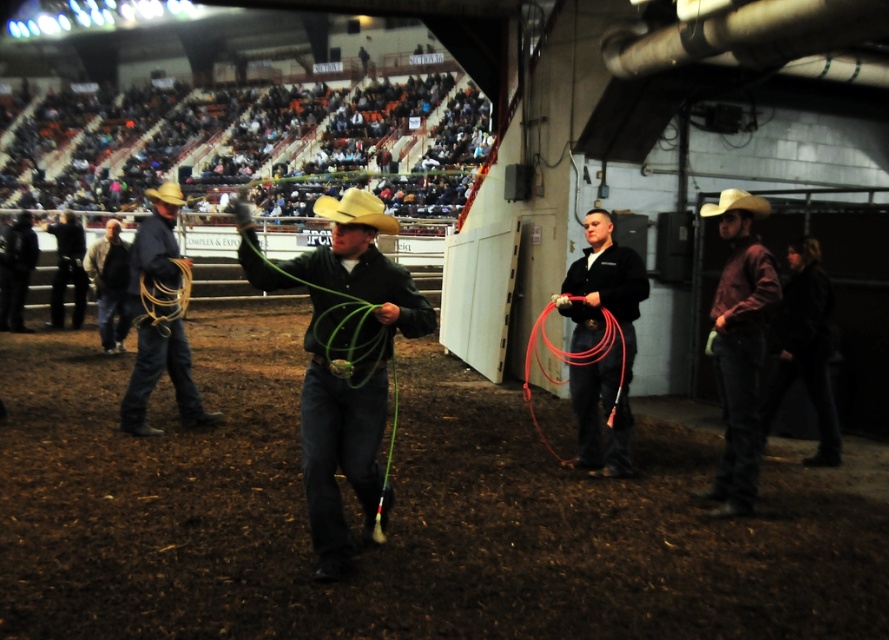
You are a photographer setting up for a rodeo event. You have two cowboy hats in your viewfinder, the black leather cowboy hat at left and the rustic leather cowboy hat at center. Which hat takes up more space in your photo?

The rustic leather cowboy hat at center takes up more space in the photo because it occupies more space than the black leather cowboy hat at left.

You are a photographer positioned at the front of the rodeo arena. You need to capture a photo that includes both the black leather cowboy hat at left and the rustic leather cowboy hat at center. Which hat will appear closer to the camera in your photo?

The black leather cowboy hat at left will appear closer to the camera in your photo because it is further to the viewer than the rustic leather cowboy hat at center.